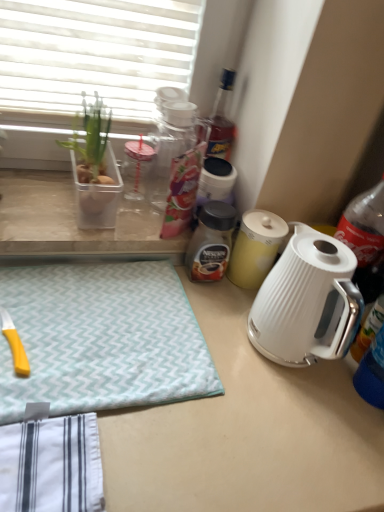
Find the location of a particular element. This screenshot has width=384, height=512. free space in front of white glossy electric kettle at center-right is located at coordinates (294, 438).